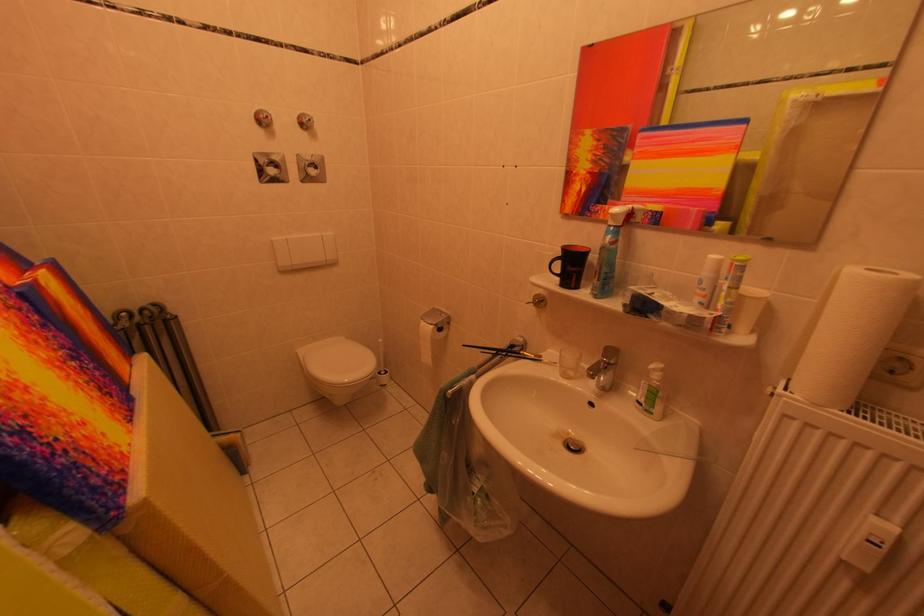
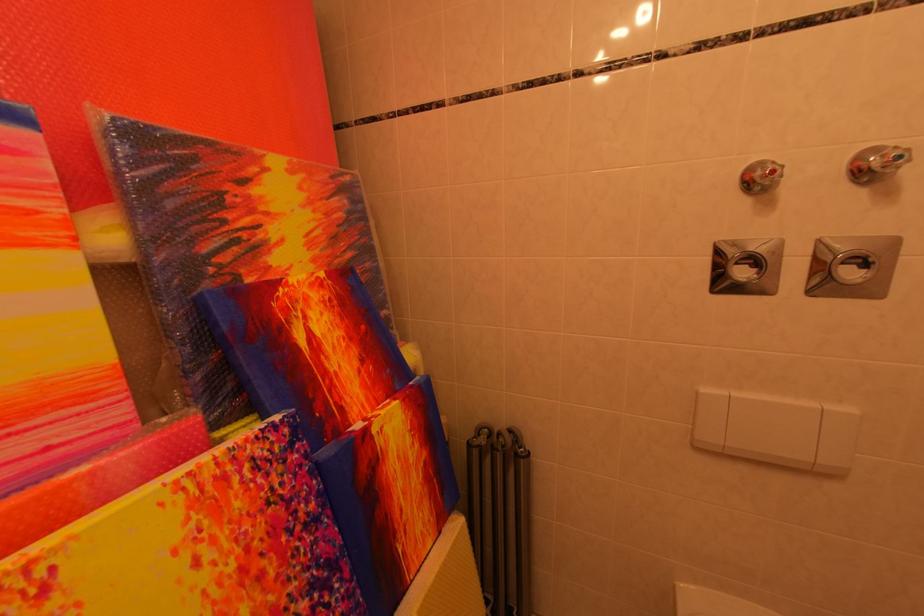
Where in the second image is the point corresponding to (x=51, y=346) from the first image?

(281, 575)